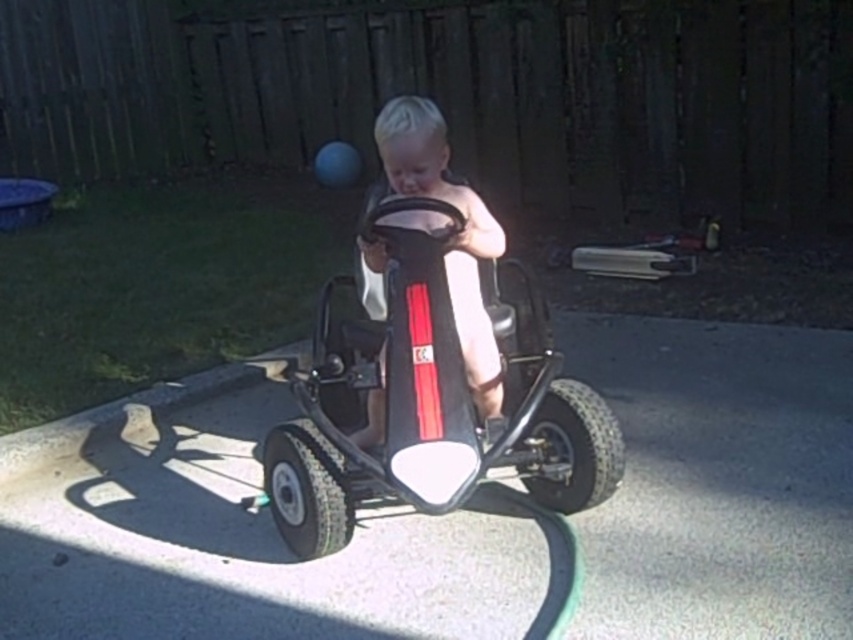
Question: Does black matte go-kart at center appear on the left side of matte black go-kart at center?

Choices:
 (A) yes
 (B) no

Answer: (A)

Question: Is black matte go-kart at center to the right of matte black go-kart at center from the viewer's perspective?

Choices:
 (A) no
 (B) yes

Answer: (A)

Question: Does black matte go-kart at center appear on the right side of matte black go-kart at center?

Choices:
 (A) yes
 (B) no

Answer: (B)

Question: Which point appears farthest from the camera in this image?

Choices:
 (A) (x=392, y=216)
 (B) (x=300, y=500)

Answer: (B)